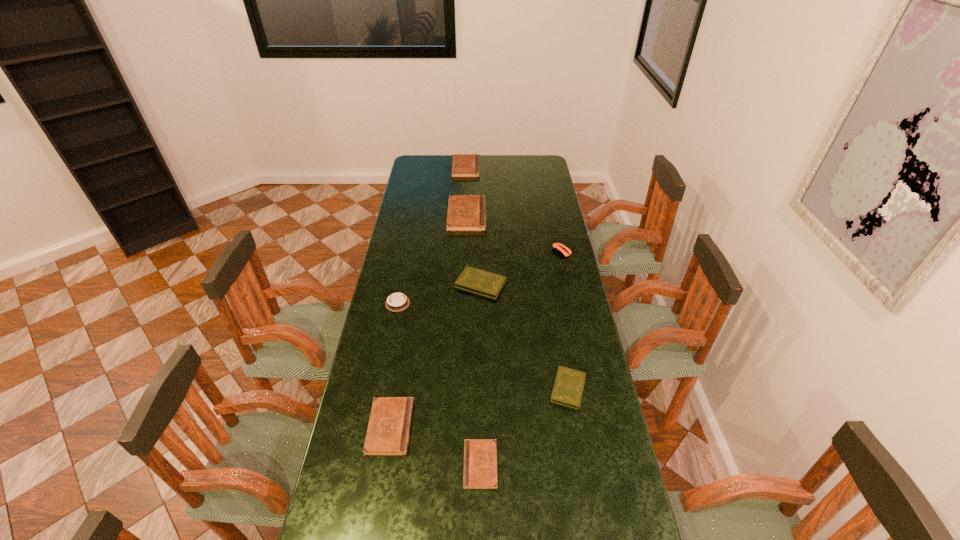
What are the coordinates of `the leftmost diary` in the screenshot? It's located at (388, 432).

Image resolution: width=960 pixels, height=540 pixels. What are the coordinates of `the rightmost diary` in the screenshot? It's located at (568, 388).

Find the location of `the right green diary`. the right green diary is located at coordinates (568, 388).

I want to click on the smallest brown diary, so click(x=480, y=455).

The height and width of the screenshot is (540, 960). In order to click on vacant area situated 0.230m on the spine side of the seventh nearest object in this screenshot , I will do `click(533, 215)`.

Where is `vacant space located 0.160m on the spine side of the farthest diary`? Image resolution: width=960 pixels, height=540 pixels. vacant space located 0.160m on the spine side of the farthest diary is located at coordinates (508, 167).

This screenshot has width=960, height=540. In order to click on free spot located on the left of the orange computer mouse in this screenshot , I will do `click(522, 252)`.

Where is `vacant area situated on the front of the chocolate cake`? vacant area situated on the front of the chocolate cake is located at coordinates (380, 393).

The width and height of the screenshot is (960, 540). Find the location of `vacant point located 0.110m on the front of the left green diary`. vacant point located 0.110m on the front of the left green diary is located at coordinates (481, 320).

Image resolution: width=960 pixels, height=540 pixels. In order to click on free spot located 0.150m on the spine side of the leftmost diary in this screenshot , I will do `click(461, 427)`.